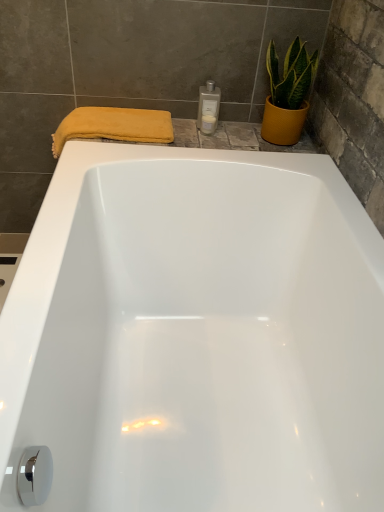
This screenshot has height=512, width=384. I want to click on free location to the right of white glossy bottle at upper right, which ranks as the 1th toiletry in top-to-bottom order, so click(243, 134).